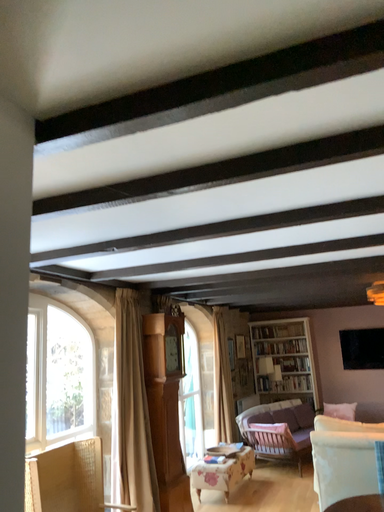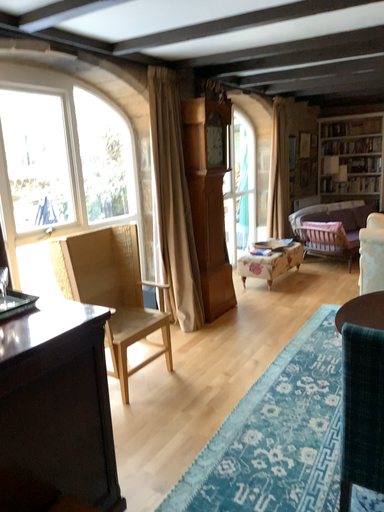
Question: How did the camera likely rotate when shooting the video?

Choices:
 (A) rotated downward
 (B) rotated upward

Answer: (A)